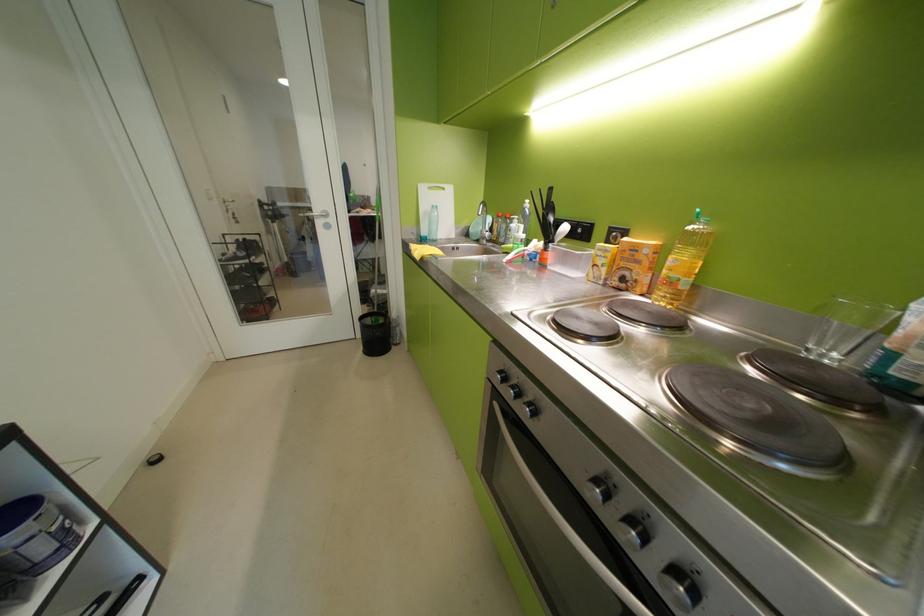
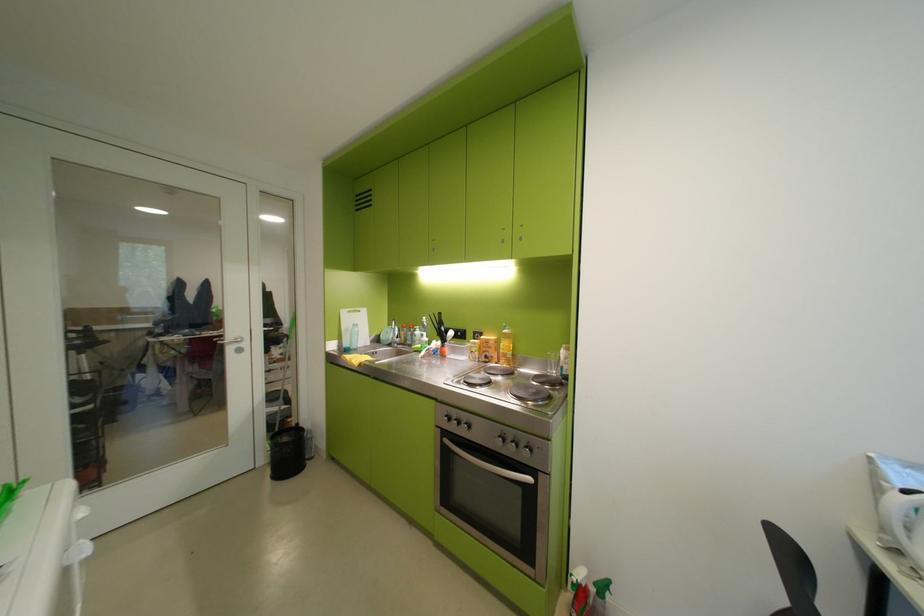
Locate, in the second image, the point that corresponds to [433,233] in the first image.

(357, 345)